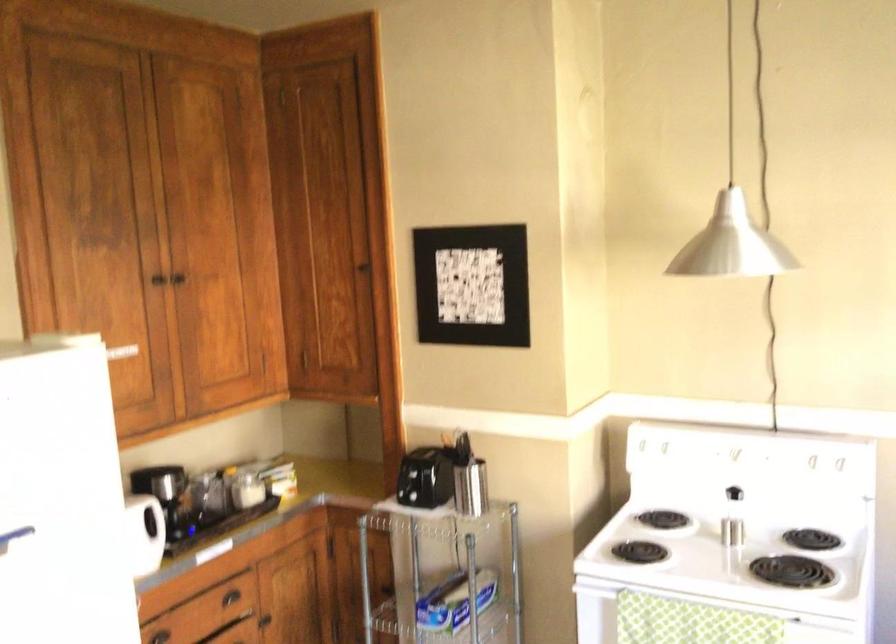
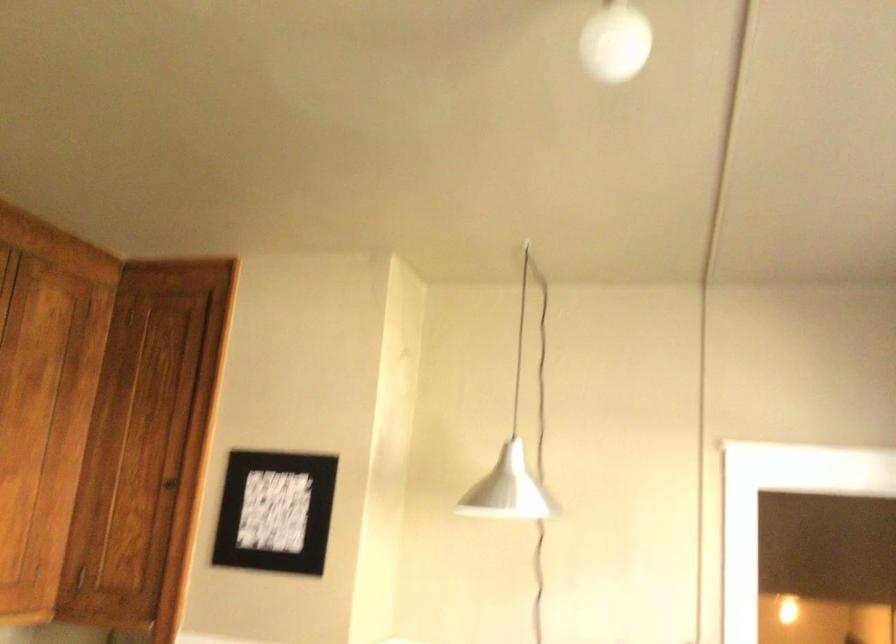
Which direction would the cameraman need to move to produce the second image?

The movement direction of the cameraman is left, backward.